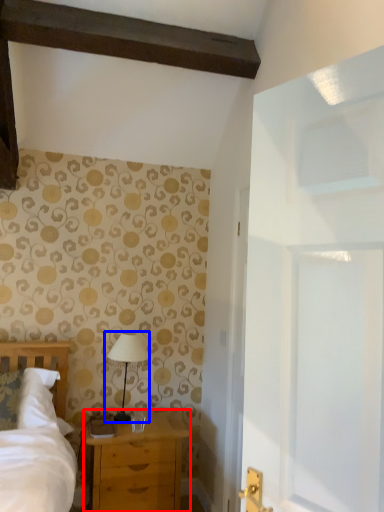
Question: Which object is further to the camera taking this photo, chest of drawers (highlighted by a red box) or table lamp (highlighted by a blue box)?

Choices:
 (A) chest of drawers
 (B) table lamp

Answer: (B)